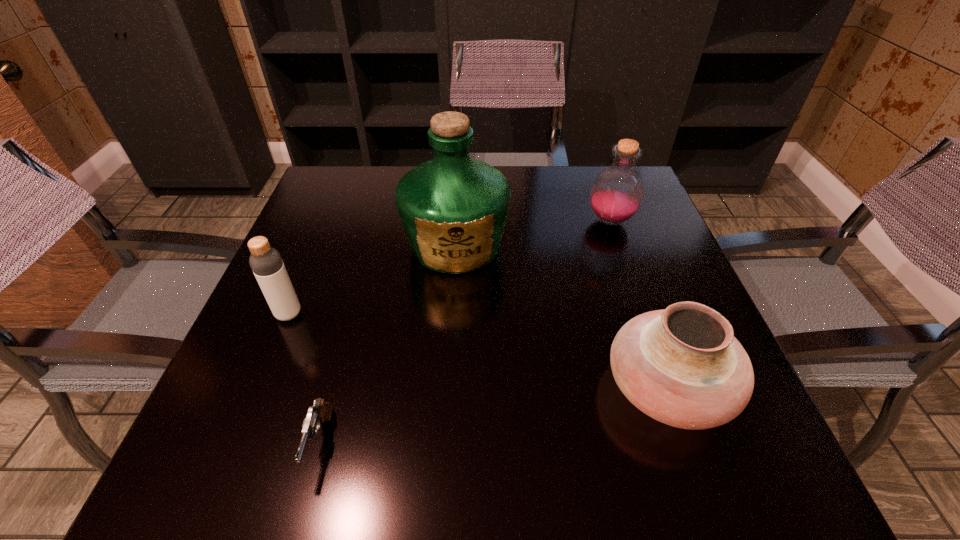
This screenshot has height=540, width=960. I want to click on the tallest object, so click(453, 208).

You are a GUI agent. You are given a task and a screenshot of the screen. Output one action in this format:
    pyautogui.click(x=<x>, y=<y>)
    Task: Click on the liquor
    This screenshot has height=540, width=960.
    Given the screenshot: What is the action you would take?
    pyautogui.click(x=453, y=208)

Identify the location of the farther bottle. (617, 192).

This screenshot has width=960, height=540. Identify the location of the leftmost object. (266, 262).

Find the location of a particular element. This screenshot has height=540, width=960. the nearer bottle is located at coordinates (266, 262).

I want to click on pottery, so click(682, 366).

The height and width of the screenshot is (540, 960). Identify the location of the shortest object. [321, 411].

You are a GUI agent. You are given a task and a screenshot of the screen. Output one action in this format:
    pyautogui.click(x=<x>, y=<y>)
    Task: Click on the pistol
    
    Given the screenshot: What is the action you would take?
    pyautogui.click(x=321, y=411)

At what (x,y) coordinates should I click in order to perform the action: click on vacant space positioned on the label side of the tallest object. Please return your answer as a coordinate pair (x, y). Looking at the image, I should click on (451, 317).

Find the location of a particular element. Image resolution: width=960 pixels, height=540 pixels. vacant region located 0.370m on the front of the right bottle is located at coordinates (660, 364).